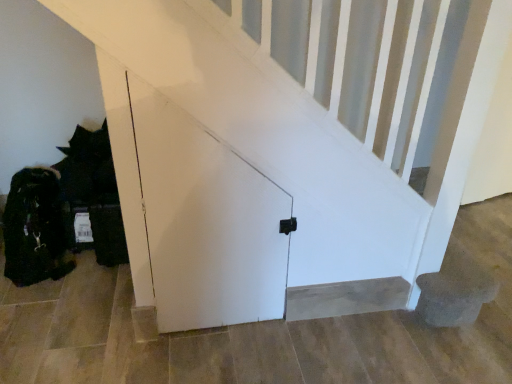
Locate an element on the screen. The height and width of the screenshot is (384, 512). empty space that is ontop of white matte door at center is located at coordinates (200, 46).